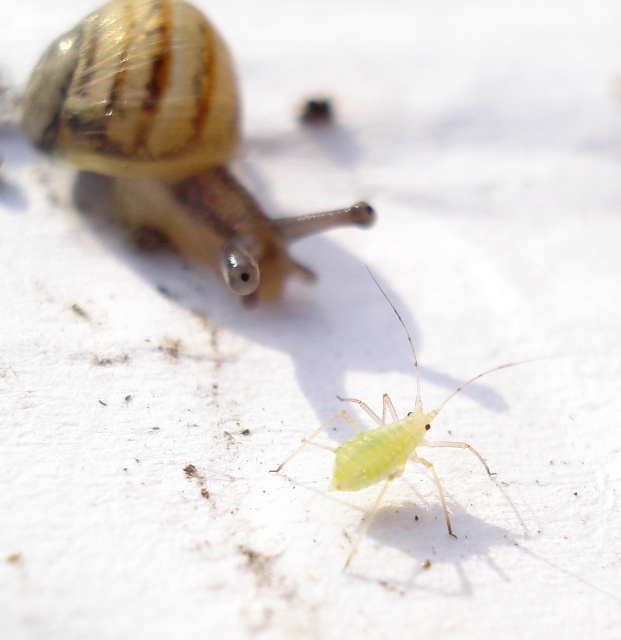
Question: Which point is farther to the camera?

Choices:
 (A) green translucent aphid at center
 (B) translucent brown snail at upper left

Answer: (B)

Question: Does translucent brown snail at upper left have a lesser width compared to green translucent aphid at center?

Choices:
 (A) no
 (B) yes

Answer: (A)

Question: Which point is farther from the camera taking this photo?

Choices:
 (A) (304, 442)
 (B) (176, 35)

Answer: (B)

Question: Does translucent brown snail at upper left appear on the right side of green translucent aphid at center?

Choices:
 (A) yes
 (B) no

Answer: (B)

Question: Is translucent brown snail at upper left to the right of green translucent aphid at center from the viewer's perspective?

Choices:
 (A) no
 (B) yes

Answer: (A)